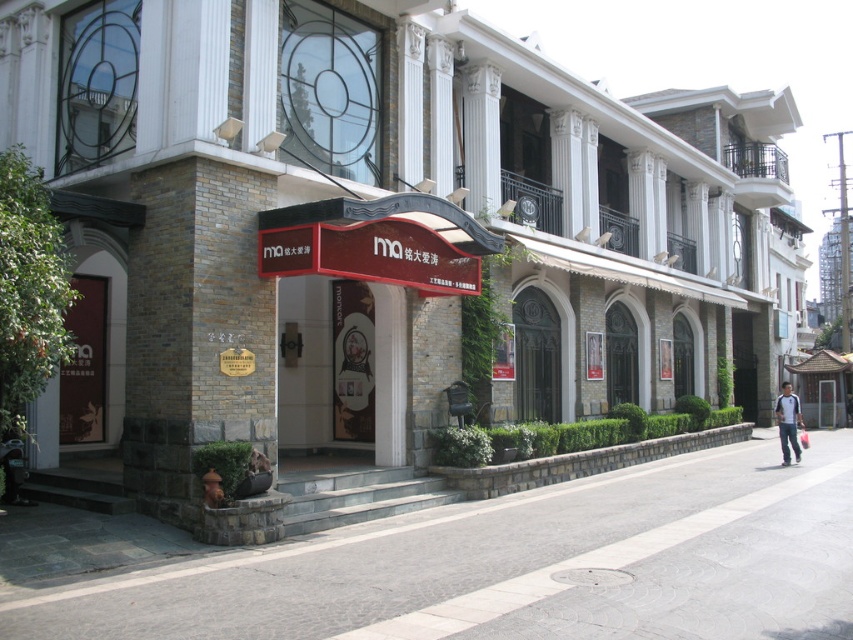
Is point (171, 566) positioned before point (784, 396)?

Yes, it is.

Is gray concrete pavement at lower center below blue jeans at lower right?

Yes, gray concrete pavement at lower center is below blue jeans at lower right.

Is point (757, 636) positioned after point (799, 419)?

No, (757, 636) is in front of (799, 419).

In order to click on gray concrete pavement at lower center in this screenshot , I will do (x=520, y=566).